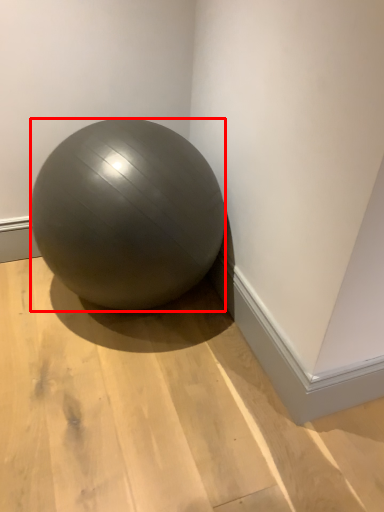
Question: Considering the relative positions of ball (annotated by the red box) and surface in the image provided, where is ball (annotated by the red box) located with respect to the staircase?

Choices:
 (A) right
 (B) left

Answer: (B)